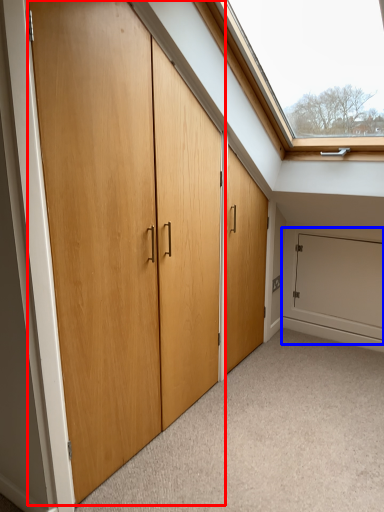
Question: Which object appears farthest to the camera in this image, door (highlighted by a red box) or garage door (highlighted by a blue box)?

Choices:
 (A) door
 (B) garage door

Answer: (B)